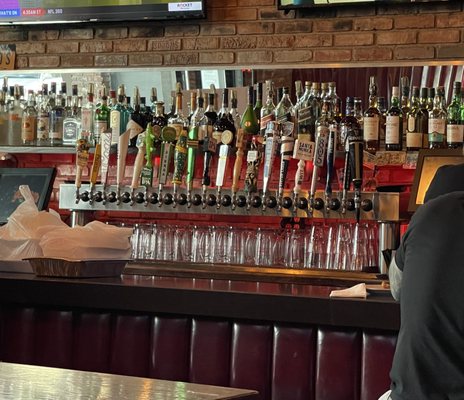
This screenshot has height=400, width=464. What are the coordinates of `black counter` in the screenshot? It's located at tap(193, 286).